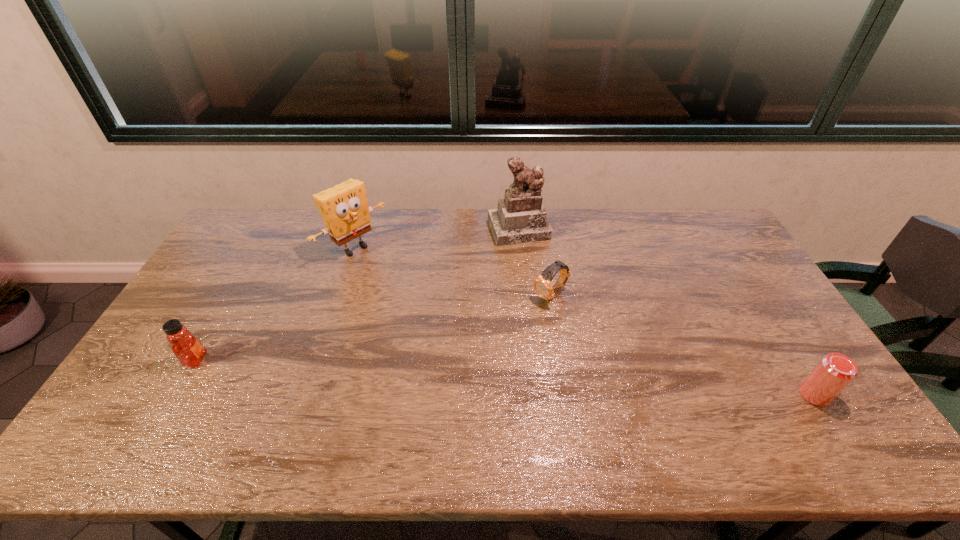
Where is `vacant spot on the desktop that is between the fourth farthest object and the nearest object and is positioned on the face of the third farthest object`? The image size is (960, 540). vacant spot on the desktop that is between the fourth farthest object and the nearest object and is positioned on the face of the third farthest object is located at coordinates (448, 374).

Where is `vacant spot on the desktop that is between the honey and the beer can and is positioned on the front-facing side of the tallest object`? The image size is (960, 540). vacant spot on the desktop that is between the honey and the beer can and is positioned on the front-facing side of the tallest object is located at coordinates (578, 381).

This screenshot has width=960, height=540. Find the location of `free spot on the desktop that is between the second nearest object and the beer can and is positioned on the face of the second tallest object`. free spot on the desktop that is between the second nearest object and the beer can and is positioned on the face of the second tallest object is located at coordinates (517, 378).